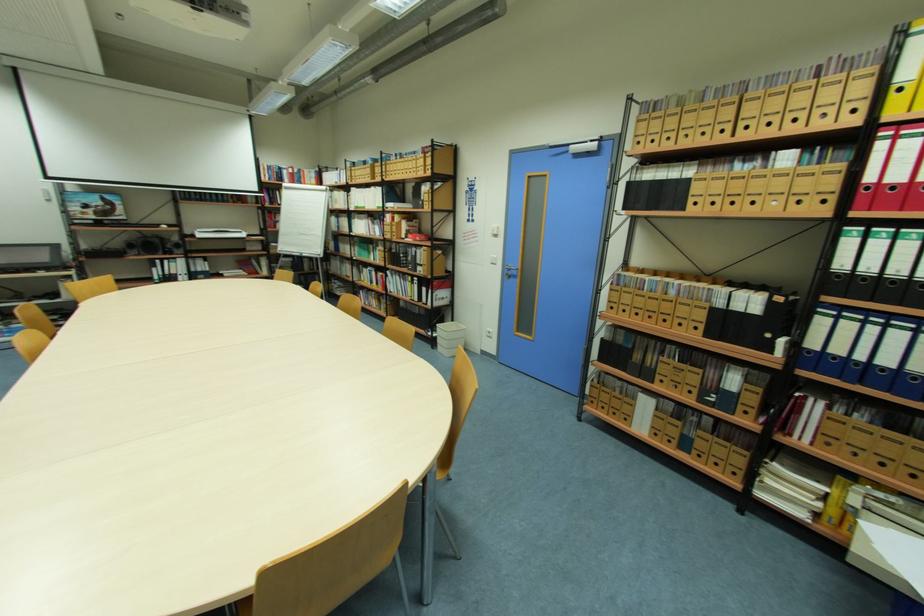
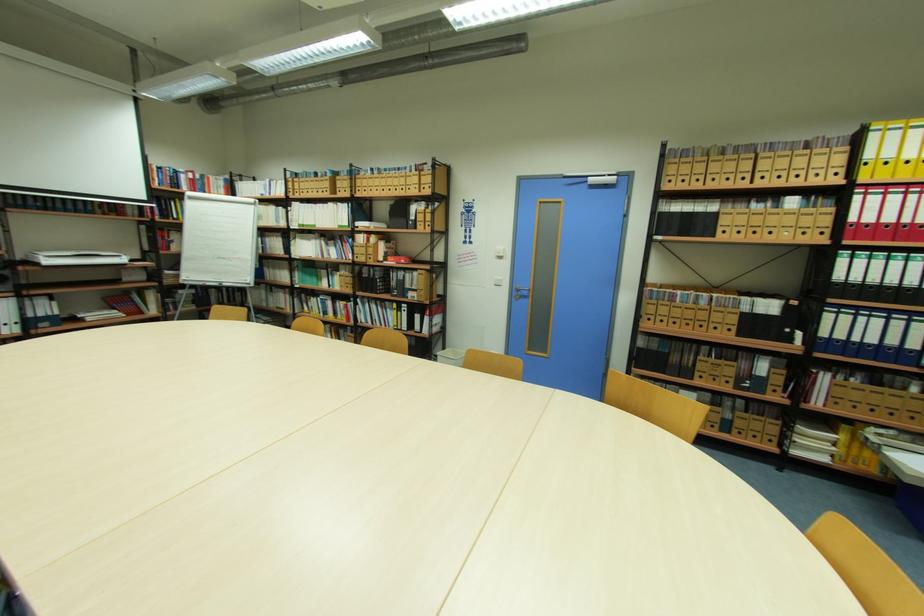
Question: In a continuous first-person perspective shot, in which direction is the camera moving?

Choices:
 (A) Left
 (B) Right
 (C) Forward
 (D) Backward

Answer: (A)